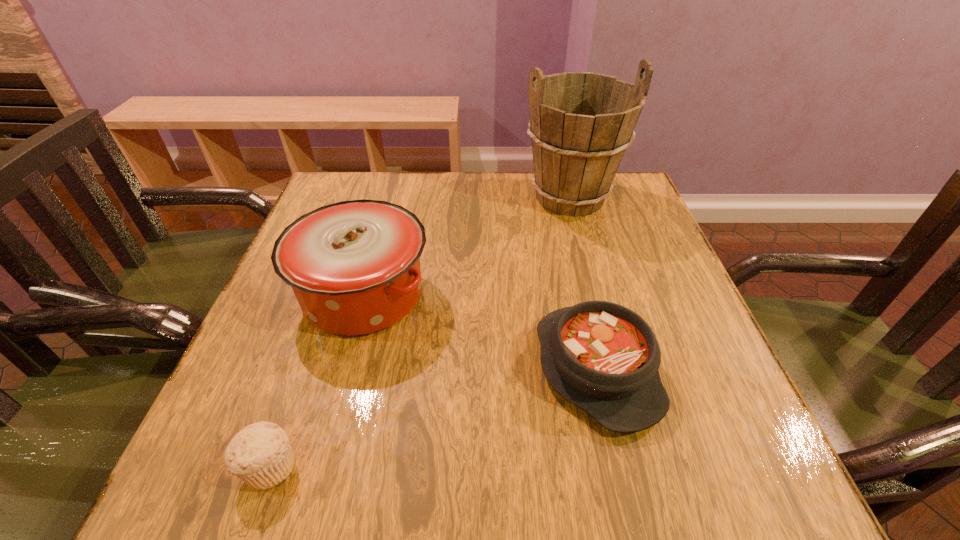
Image resolution: width=960 pixels, height=540 pixels. In order to click on bucket in this screenshot , I will do pos(581,123).

Find the location of a particular element. The height and width of the screenshot is (540, 960). the farthest object is located at coordinates (581, 123).

Identify the location of the second tallest object. (354, 266).

What are the coordinates of `the taller casserole` in the screenshot? It's located at 354,266.

Locate an element on the screen. the right casserole is located at coordinates (604, 358).

At what (x,y) coordinates should I click in order to perform the action: click on muffin. Please return your answer as a coordinate pair (x, y). Looking at the image, I should click on (260, 454).

Find the location of a particular element. free space located 0.250m on the left of the farthest object is located at coordinates (427, 198).

Locate an element on the screen. free location located 0.360m on the right of the left casserole is located at coordinates (604, 294).

Identify the location of vacant region located on the back of the right casserole. The height and width of the screenshot is (540, 960). (559, 206).

You are a GUI agent. You are given a task and a screenshot of the screen. Output one action in this format:
    pyautogui.click(x=<x>, y=<y>)
    Task: Click on the free spot located 0.370m on the right of the muffin
    
    Given the screenshot: What is the action you would take?
    pyautogui.click(x=544, y=465)